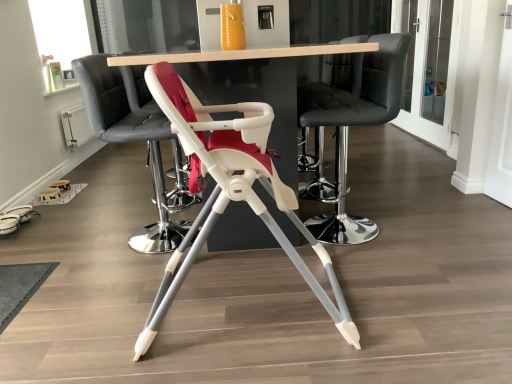
Question: Considering the relative sizes of clear glass window screen at upper left and white plastic highchair at center, marked as the 3th chair in a front-to-back arrangement, in the image provided, is clear glass window screen at upper left bigger than white plastic highchair at center, marked as the 3th chair in a front-to-back arrangement,?

Choices:
 (A) no
 (B) yes

Answer: (B)

Question: From a real-world perspective, does clear glass window screen at upper left stand above white plastic highchair at center, marked as the 3th chair in a front-to-back arrangement?

Choices:
 (A) yes
 (B) no

Answer: (A)

Question: Is the position of clear glass window screen at upper left more distant than that of white plastic highchair at center, marked as the 3th chair in a front-to-back arrangement?

Choices:
 (A) yes
 (B) no

Answer: (A)

Question: Does clear glass window screen at upper left appear on the right side of white plastic highchair at center, which appears as the second chair when viewed from the back?

Choices:
 (A) no
 (B) yes

Answer: (A)

Question: Considering the relative sizes of clear glass window screen at upper left and white plastic highchair at center, which appears as the second chair when viewed from the back, in the image provided, is clear glass window screen at upper left wider than white plastic highchair at center, which appears as the second chair when viewed from the back,?

Choices:
 (A) no
 (B) yes

Answer: (A)

Question: Is white plastic highchair at center, marked as the 3th chair in a front-to-back arrangement, at the back of clear glass window screen at upper left?

Choices:
 (A) yes
 (B) no

Answer: (B)

Question: Could clear glass window screen at upper left be considered to be inside white plastic highchair at center, which is the first chair in front-to-back order?

Choices:
 (A) no
 (B) yes

Answer: (A)

Question: From a real-world perspective, is white plastic highchair at center, positioned as the fourth chair in back-to-front order, physically below clear glass window screen at upper left?

Choices:
 (A) no
 (B) yes

Answer: (B)

Question: Is white plastic highchair at center, which is the first chair in front-to-back order, positioned far away from clear glass window screen at upper left?

Choices:
 (A) yes
 (B) no

Answer: (A)

Question: From the image's perspective, is white plastic highchair at center, positioned as the fourth chair in back-to-front order, on top of clear glass window screen at upper left?

Choices:
 (A) no
 (B) yes

Answer: (A)

Question: Can you confirm if white plastic highchair at center, which is the first chair in front-to-back order, is wider than clear glass window screen at upper left?

Choices:
 (A) yes
 (B) no

Answer: (A)

Question: Does white plastic highchair at center, positioned as the fourth chair in back-to-front order, come behind clear glass window screen at upper left?

Choices:
 (A) no
 (B) yes

Answer: (A)

Question: Can you confirm if white plastic highchair at center, which appears as the second chair when viewed from the back, is smaller than wooden table at center?

Choices:
 (A) no
 (B) yes

Answer: (B)